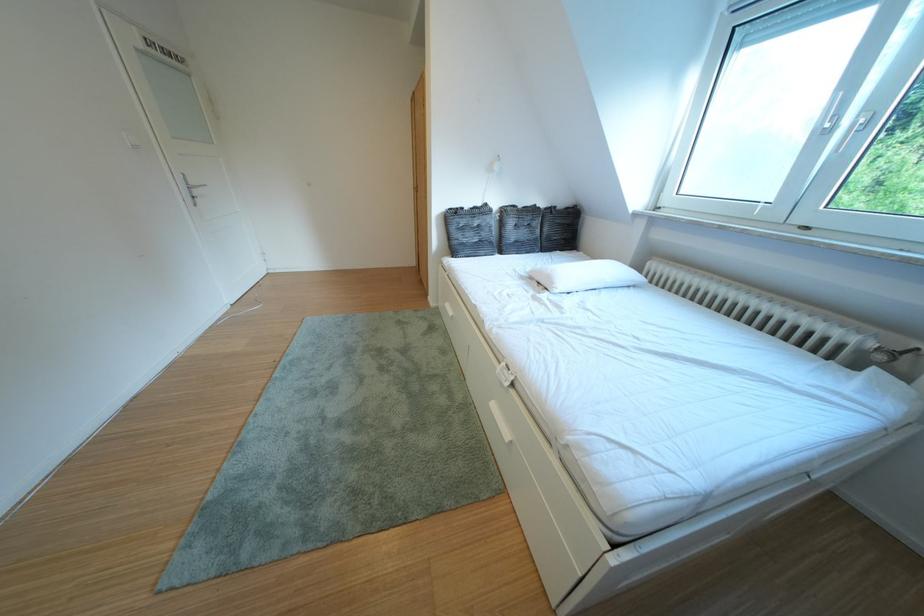
What do you see at coordinates (862, 120) in the screenshot? I see `the white window handle` at bounding box center [862, 120].